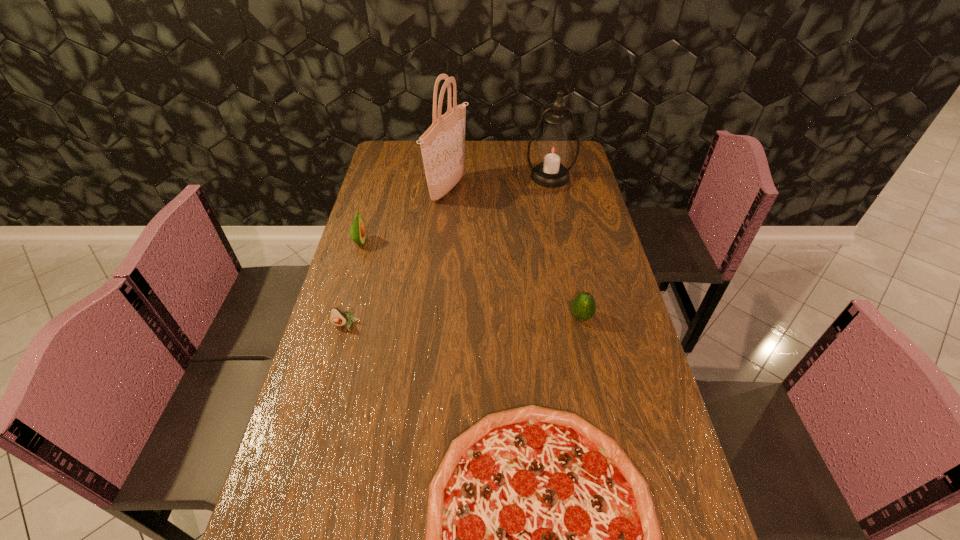
Where is `free space located 0.270m on the back of the rightmost avocado`? free space located 0.270m on the back of the rightmost avocado is located at coordinates (566, 247).

This screenshot has width=960, height=540. Identify the location of vacant space located on the seed side of the shortest avocado. (306, 467).

Where is `shopping bag situated at the far edge`? shopping bag situated at the far edge is located at coordinates (443, 144).

Locate an element on the screen. The height and width of the screenshot is (540, 960). oil lamp present at the far edge is located at coordinates (553, 149).

Find the location of a particular element. This screenshot has height=540, width=960. oil lamp that is positioned at the right edge is located at coordinates (553, 149).

Where is `avocado that is at the right edge`? avocado that is at the right edge is located at coordinates (583, 307).

Locate an element on the screen. Image resolution: width=960 pixels, height=540 pixels. object that is at the far right corner is located at coordinates (553, 149).

I want to click on vacant space at the left edge of the desktop, so click(372, 188).

Where is `vacant point at the right edge`? The image size is (960, 540). vacant point at the right edge is located at coordinates (605, 275).

You are a GUI agent. You are given a task and a screenshot of the screen. Output one action in this format:
    pyautogui.click(x=<x>, y=<y>)
    Task: Click on the free point between the tallest avocado and the third shortest object
    This screenshot has height=540, width=960.
    Given the screenshot: What is the action you would take?
    pyautogui.click(x=470, y=280)